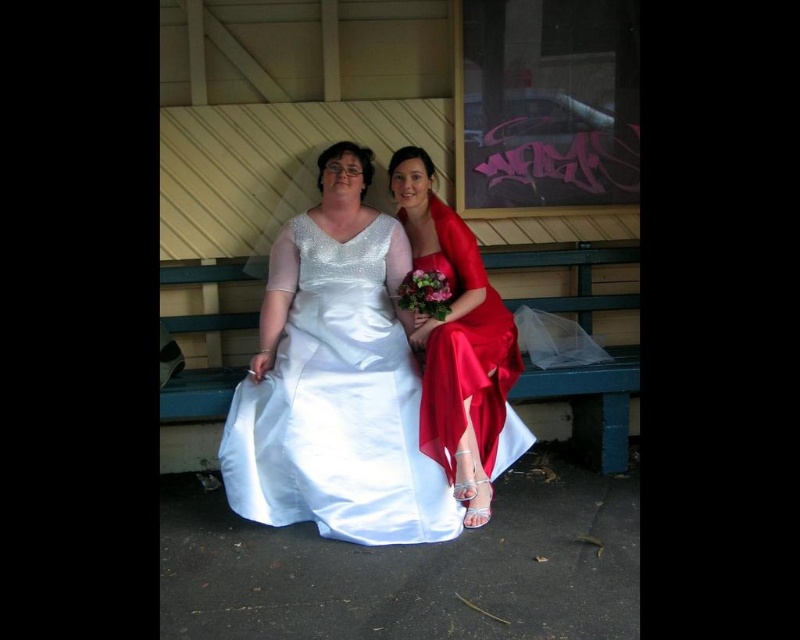
Question: Is satin white dress at center to the left of satin dress at center from the viewer's perspective?

Choices:
 (A) yes
 (B) no

Answer: (A)

Question: Estimate the real-world distances between objects in this image. Which object is closer to the satin white dress at center?

Choices:
 (A) green wooden bench at center
 (B) satin dress at center

Answer: (B)

Question: Which point is farther to the camera?

Choices:
 (A) (266, 515)
 (B) (478, 518)
 (C) (164, 417)

Answer: (C)

Question: Does satin white dress at center come behind satin dress at center?

Choices:
 (A) yes
 (B) no

Answer: (A)

Question: Can you confirm if satin dress at center is bigger than green wooden bench at center?

Choices:
 (A) no
 (B) yes

Answer: (B)

Question: Which of the following is the closest to the observer?

Choices:
 (A) green wooden bench at center
 (B) satin white dress at center
 (C) satin dress at center

Answer: (C)